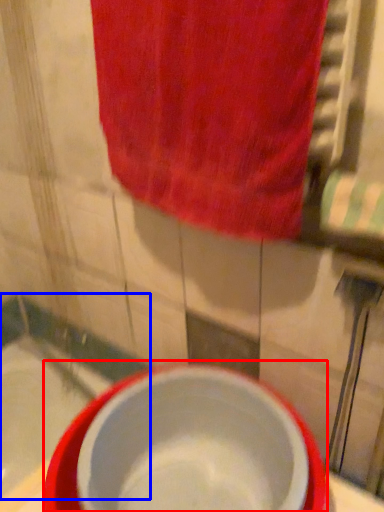
Question: Which object is further to the camera taking this photo, basin (highlighted by a red box) or bath (highlighted by a blue box)?

Choices:
 (A) basin
 (B) bath

Answer: (B)